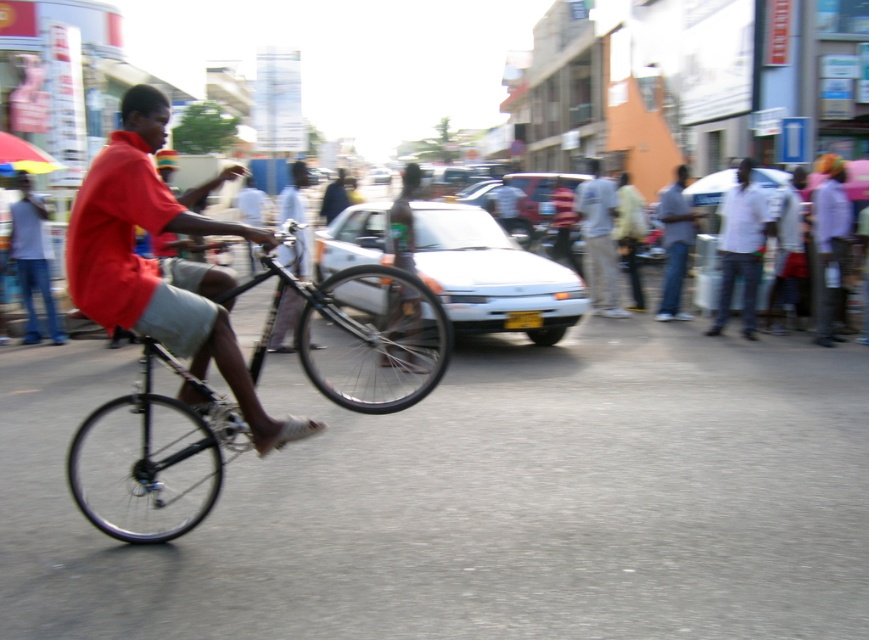
You are standing on the sidewalk and want to take a photo of the cyclist and the parked white sedan. Which point, point (748, 252) or point (594, 214), is closer to you?

Point (748, 252) is closer to you than point (594, 214).

You are a delivery person who needs to load a package onto the shiny black bicycle at center and the light gray cotton pants at center. Which object requires a wider space for loading?

The light gray cotton pants at center requires a wider space for loading because the shiny black bicycle at center is narrower than it.

You are a photographer trying to capture the cyclist in motion. You notice a point at coordinates (x=151, y=458) in the image. Where is this point located?

The point at coordinates (x=151, y=458) is located on the shiny black bicycle at center.